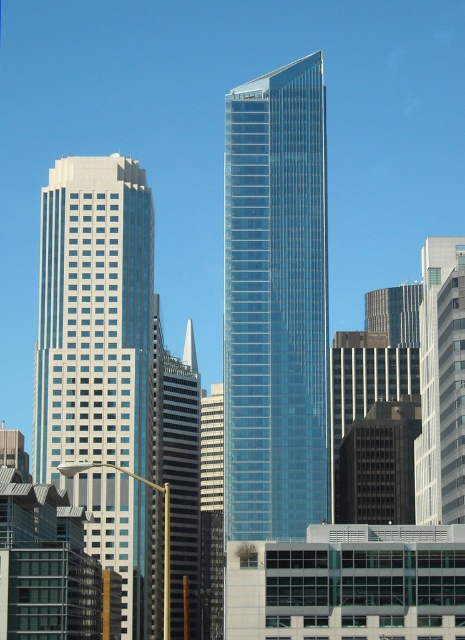
Does white glass building at left lie in front of white glass building at right?

No, it is not.

Is white glass building at left to the left of white glass building at right from the viewer's perspective?

Yes, white glass building at left is to the left of white glass building at right.

Does point (112, 445) come closer to viewer compared to point (433, 289)?

No, (112, 445) is behind (433, 289).

This screenshot has height=640, width=465. I want to click on white glass building at left, so click(99, 358).

Who is taller, transparent glass skyscraper at center or white glass building at right?

With more height is transparent glass skyscraper at center.

This screenshot has height=640, width=465. Identify the location of transparent glass skyscraper at center. (276, 304).

Identify the location of transparent glass skyscraper at center. This screenshot has height=640, width=465. (276, 304).

Consider the image. Is transparent glass skyscraper at center in front of white glass building at left?

Yes, it is in front of white glass building at left.

Is transparent glass skyscraper at center to the left of white glass building at left from the viewer's perspective?

Incorrect, transparent glass skyscraper at center is not on the left side of white glass building at left.

Where is `transparent glass skyscraper at center`? The width and height of the screenshot is (465, 640). transparent glass skyscraper at center is located at coordinates (276, 304).